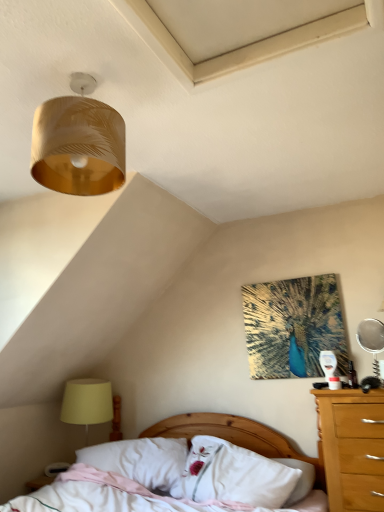
Describe the element at coordinates (235, 475) in the screenshot. Image resolution: width=384 pixels, height=512 pixels. I see `white soft pillow at center, positioned as the 2th pillow in left-to-right order` at that location.

The image size is (384, 512). Describe the element at coordinates (87, 403) in the screenshot. I see `yellow fabric lampshade at lower left` at that location.

I want to click on white soft pillow at center, acting as the first pillow starting from the left, so click(142, 461).

Describe the element at coordinates (142, 461) in the screenshot. The height and width of the screenshot is (512, 384). I see `white soft pillow at center, the 2th pillow when ordered from right to left` at that location.

Where is `gold textured lampshade at upper left`? The height and width of the screenshot is (512, 384). gold textured lampshade at upper left is located at coordinates (78, 143).

Between point (84, 393) and point (291, 488), which one is positioned behind?

The point (84, 393) is farther from the camera.

Considering the relative sizes of yellow fabric lampshade at lower left and white soft pillow at center, positioned as the 2th pillow in left-to-right order, in the image provided, is yellow fabric lampshade at lower left smaller than white soft pillow at center, positioned as the 2th pillow in left-to-right order,?

Yes.

From a real-world perspective, is yellow fabric lampshade at lower left located beneath white soft pillow at center, which is the 1th pillow in right-to-left order?

Incorrect, from a real-world perspective, yellow fabric lampshade at lower left is higher than white soft pillow at center, which is the 1th pillow in right-to-left order.

From a real-world perspective, who is located higher, white soft pillow at center, the 2th pillow when ordered from right to left, or yellow fabric lampshade at lower left?

yellow fabric lampshade at lower left.

At what (x,y) coordinates should I click in order to perform the action: click on pillow below the yellow fabric lampshade at lower left (from the image's perspective). Please return your answer as a coordinate pair (x, y). Looking at the image, I should click on (142, 461).

Which object is further away from the camera taking this photo, yellow fabric lampshade at lower left or white soft pillow at center, acting as the first pillow starting from the left?

Positioned behind is yellow fabric lampshade at lower left.

The height and width of the screenshot is (512, 384). In order to click on pillow located below the yellow fabric lampshade at lower left (from the image's perspective) in this screenshot , I will do `click(142, 461)`.

Considering the relative positions of yellow fabric lampshade at lower left and white soft pillow at center, the 2th pillow when ordered from right to left, in the image provided, is yellow fabric lampshade at lower left to the left or to the right of white soft pillow at center, the 2th pillow when ordered from right to left,?

Clearly, yellow fabric lampshade at lower left is on the left of white soft pillow at center, the 2th pillow when ordered from right to left, in the image.

Is point (280, 452) closer to viewer compared to point (82, 103)?

No, it is behind (82, 103).

Does wooden bed at lower center have a lesser width compared to gold textured lampshade at upper left?

Incorrect, the width of wooden bed at lower center is not less than that of gold textured lampshade at upper left.

From a real-world perspective, is wooden bed at lower center on gold textured lampshade at upper left?

Actually, wooden bed at lower center is physically below gold textured lampshade at upper left in the real world.

Does white soft pillow at center, acting as the first pillow starting from the left, appear on the right side of wooden bed at lower center?

In fact, white soft pillow at center, acting as the first pillow starting from the left, is to the left of wooden bed at lower center.

Does white soft pillow at center, the 2th pillow when ordered from right to left, have a lesser width compared to wooden bed at lower center?

→ Yes, white soft pillow at center, the 2th pillow when ordered from right to left, is thinner than wooden bed at lower center.

From a real-world perspective, is white soft pillow at center, the 2th pillow when ordered from right to left, on top of wooden bed at lower center?

Indeed, from a real-world perspective, white soft pillow at center, the 2th pillow when ordered from right to left, stands above wooden bed at lower center.

Locate an element on the screen. pillow on the left of the wooden bed at lower center is located at coordinates (142, 461).

Considering the positions of objects white soft pillow at center, positioned as the 2th pillow in left-to-right order, and yellow fabric lampshade at lower left in the image provided, who is in front, white soft pillow at center, positioned as the 2th pillow in left-to-right order, or yellow fabric lampshade at lower left?

white soft pillow at center, positioned as the 2th pillow in left-to-right order, is in front.

How distant is white soft pillow at center, which is the 1th pillow in right-to-left order, from yellow fabric lampshade at lower left?

They are 96.16 centimeters apart.

Considering the sizes of objects white soft pillow at center, which is the 1th pillow in right-to-left order, and yellow fabric lampshade at lower left in the image provided, who is smaller, white soft pillow at center, which is the 1th pillow in right-to-left order, or yellow fabric lampshade at lower left?

Smaller between the two is yellow fabric lampshade at lower left.

Considering the sizes of white soft pillow at center, which is the 1th pillow in right-to-left order, and yellow fabric lampshade at lower left in the image, is white soft pillow at center, which is the 1th pillow in right-to-left order, wider or thinner than yellow fabric lampshade at lower left?

Considering their sizes, white soft pillow at center, which is the 1th pillow in right-to-left order, looks slimmer than yellow fabric lampshade at lower left.

Which of these two, white soft pillow at center, which is the 1th pillow in right-to-left order, or white soft pillow at center, the 2th pillow when ordered from right to left, is smaller?

white soft pillow at center, the 2th pillow when ordered from right to left.

In the image, is white soft pillow at center, which is the 1th pillow in right-to-left order, on the left side or the right side of white soft pillow at center, acting as the first pillow starting from the left?

In the image, white soft pillow at center, which is the 1th pillow in right-to-left order, appears on the right side of white soft pillow at center, acting as the first pillow starting from the left.

Is white soft pillow at center, acting as the first pillow starting from the left, inside white soft pillow at center, which is the 1th pillow in right-to-left order?

Definitely not — white soft pillow at center, acting as the first pillow starting from the left, is not inside white soft pillow at center, which is the 1th pillow in right-to-left order.

From a real-world perspective, between white soft pillow at center, which is the 1th pillow in right-to-left order, and white soft pillow at center, acting as the first pillow starting from the left, who is vertically higher?

In real-world perspective, white soft pillow at center, which is the 1th pillow in right-to-left order, is above.

Locate an element on the screen. This screenshot has width=384, height=512. table lamp above the white soft pillow at center, positioned as the 2th pillow in left-to-right order (from a real-world perspective) is located at coordinates (87, 403).

Locate an element on the screen. This screenshot has width=384, height=512. pillow that is the 2nd object directly below the yellow fabric lampshade at lower left (from a real-world perspective) is located at coordinates (142, 461).

From the image, which object appears to be nearer to silver metallic mirror at right, gold textured lampshade at upper left or yellow fabric lampshade at lower left?

yellow fabric lampshade at lower left is closer to silver metallic mirror at right.

In the scene shown: Which object lies nearer to the anchor point yellow fabric lampshade at lower left, white soft pillow at center, positioned as the 2th pillow in left-to-right order, or gold textured lampshade at upper left?

Among the two, white soft pillow at center, positioned as the 2th pillow in left-to-right order, is located nearer to yellow fabric lampshade at lower left.

Based on their spatial positions, is wooden bed at lower center or white soft pillow at center, positioned as the 2th pillow in left-to-right order, closer to yellow fabric lampshade at lower left?

Among the two, wooden bed at lower center is located nearer to yellow fabric lampshade at lower left.

Based on their spatial positions, is silver metallic mirror at right or white soft pillow at center, acting as the first pillow starting from the left, further from yellow fabric lampshade at lower left?

silver metallic mirror at right is further to yellow fabric lampshade at lower left.

When comparing their distances from gold textured lampshade at upper left, does wooden bed at lower center or yellow fabric lampshade at lower left seem further?

Based on the image, wooden bed at lower center appears to be further to gold textured lampshade at upper left.

When comparing their distances from yellow fabric lampshade at lower left, does gold textured lampshade at upper left or wooden bed at lower center seem closer?

wooden bed at lower center is positioned closer to the anchor yellow fabric lampshade at lower left.

Which object lies nearer to the anchor point wooden bed at lower center, yellow fabric lampshade at lower left or white soft pillow at center, positioned as the 2th pillow in left-to-right order?

The object closer to wooden bed at lower center is white soft pillow at center, positioned as the 2th pillow in left-to-right order.

Based on their spatial positions, is white soft pillow at center, positioned as the 2th pillow in left-to-right order, or yellow fabric lampshade at lower left further from gold textured lampshade at upper left?

Among the two, yellow fabric lampshade at lower left is located further to gold textured lampshade at upper left.

The width and height of the screenshot is (384, 512). In order to click on pillow between gold textured lampshade at upper left and wooden bed at lower center from top to bottom in this screenshot , I will do `click(235, 475)`.

At what (x,y) coordinates should I click in order to perform the action: click on mechanical fan between gold textured lampshade at upper left and white soft pillow at center, which is the 1th pillow in right-to-left order, in the up-down direction. Please return your answer as a coordinate pair (x, y). The height and width of the screenshot is (512, 384). Looking at the image, I should click on click(371, 340).

I want to click on mechanical fan between gold textured lampshade at upper left and white soft pillow at center, acting as the first pillow starting from the left, from top to bottom, so click(x=371, y=340).

Find the location of a particular element. pillow between white soft pillow at center, acting as the first pillow starting from the left, and silver metallic mirror at right from left to right is located at coordinates (235, 475).